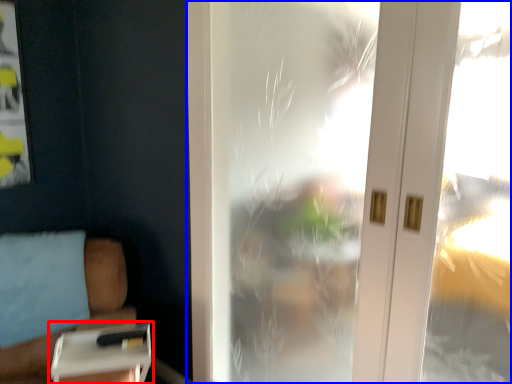
Question: Which object is further to the camera taking this photo, table (highlighted by a red box) or window (highlighted by a blue box)?

Choices:
 (A) table
 (B) window

Answer: (A)